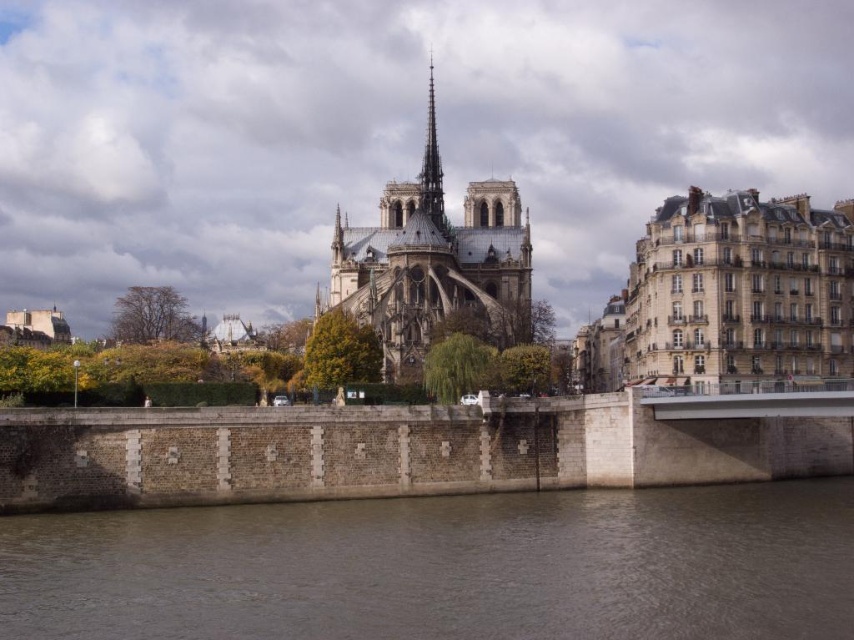
Question: Which of the following is the farthest from the observer?

Choices:
 (A) concrete bridge at center
 (B) brown stone wall at lower center
 (C) stone gothic cathedral at center
 (D) smooth gray spire at center

Answer: (D)

Question: Considering the real-world distances, which object is closest to the smooth gray spire at center?

Choices:
 (A) stone gothic cathedral at center
 (B) concrete bridge at center
 (C) brown stone wall at lower center

Answer: (A)

Question: Can you confirm if brown stone wall at lower center is thinner than stone gothic cathedral at center?

Choices:
 (A) no
 (B) yes

Answer: (A)

Question: Does brown stone wall at lower center have a smaller size compared to stone gothic cathedral at center?

Choices:
 (A) yes
 (B) no

Answer: (A)

Question: Which object appears farthest from the camera in this image?

Choices:
 (A) brown stone wall at lower center
 (B) stone gothic cathedral at center

Answer: (B)

Question: Can you confirm if concrete bridge at center is positioned below smooth gray spire at center?

Choices:
 (A) no
 (B) yes

Answer: (B)